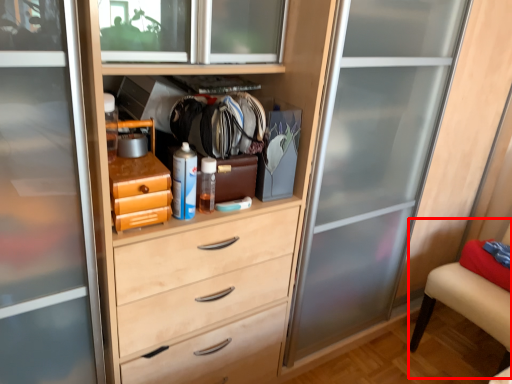
Question: From the image's perspective, what is the correct spatial relationship of armchair (annotated by the red box) in relation to bottle?

Choices:
 (A) below
 (B) above

Answer: (A)